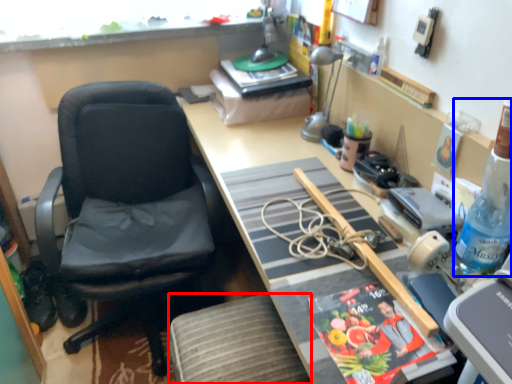
Question: Which object appears closest to the camera in this image, stool (highlighted by a red box) or bottle (highlighted by a blue box)?

Choices:
 (A) stool
 (B) bottle

Answer: (B)